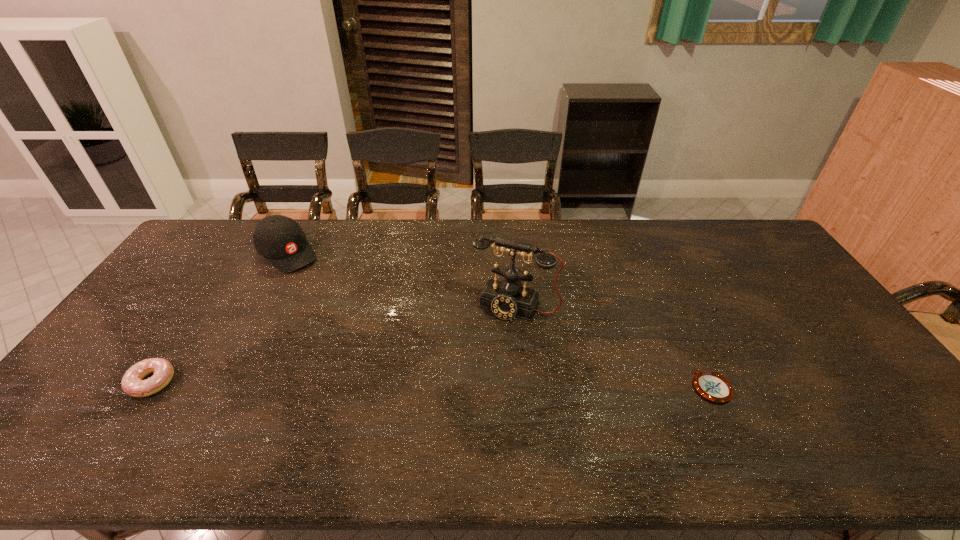
I want to click on free space located 0.320m on the dial of the tallest object, so click(x=457, y=412).

Locate an element on the screen. The width and height of the screenshot is (960, 540). free region located on the dial of the tallest object is located at coordinates (451, 422).

At what (x,y) coordinates should I click in order to perform the action: click on vacant space located on the dial of the tallest object. Please return your answer as a coordinate pair (x, y). This screenshot has height=540, width=960. Looking at the image, I should click on (490, 344).

At what (x,y) coordinates should I click in order to perform the action: click on vacant area situated 0.180m with a logo on the front of the baseball cap. Please return your answer as a coordinate pair (x, y). The height and width of the screenshot is (540, 960). Looking at the image, I should click on (331, 294).

This screenshot has height=540, width=960. What are the coordinates of `vacant space located with a logo on the front of the baseball cap` in the screenshot? It's located at (352, 313).

Find the location of a particular element. free space located with a logo on the front of the baseball cap is located at coordinates (351, 311).

This screenshot has width=960, height=540. Identify the location of object that is at the far edge. (279, 239).

Where is `doughnut located in the near edge section of the desktop`? This screenshot has height=540, width=960. doughnut located in the near edge section of the desktop is located at coordinates (x=132, y=383).

You are a GUI agent. You are given a task and a screenshot of the screen. Output one action in this format:
    pyautogui.click(x=<x>, y=<y>)
    Task: Click on the compass present at the near edge
    The image size is (960, 540).
    Given the screenshot: What is the action you would take?
    pyautogui.click(x=712, y=386)

The height and width of the screenshot is (540, 960). I want to click on object located at the left edge, so click(x=132, y=383).